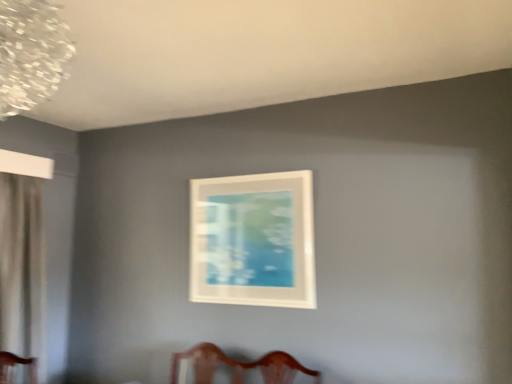
Question: In terms of height, does white sheer curtain at left look taller or shorter compared to clear crystal chandelier at upper left?

Choices:
 (A) tall
 (B) short

Answer: (A)

Question: Is point (16, 269) positioned closer to the camera than point (34, 104)?

Choices:
 (A) closer
 (B) farther

Answer: (B)

Question: Estimate the real-world distances between objects in this image. Which object is closer to the clear crystal chandelier at upper left?

Choices:
 (A) white matte picture frame at center
 (B) white sheer curtain at left

Answer: (B)

Question: Which is nearer to the white matte picture frame at center?

Choices:
 (A) white sheer curtain at left
 (B) clear crystal chandelier at upper left

Answer: (A)